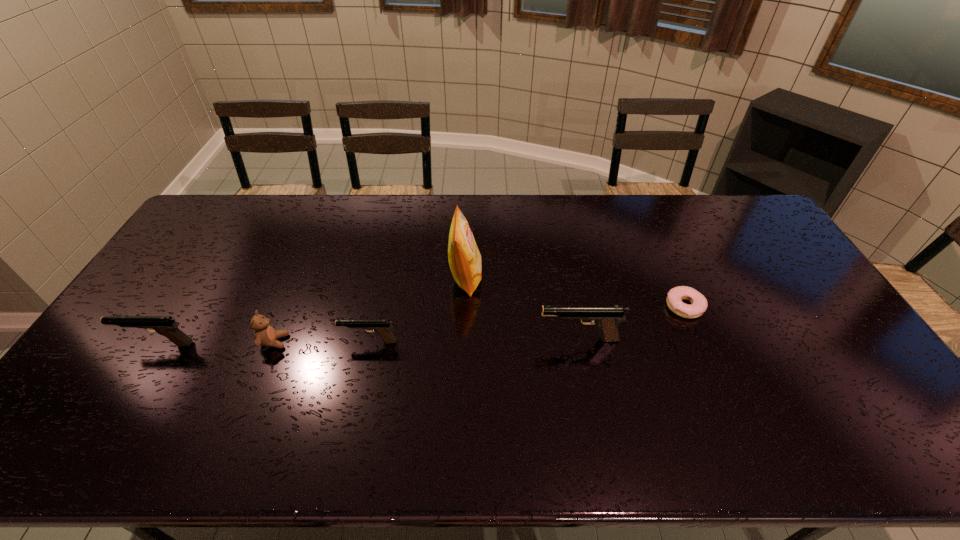
Locate an element on the screen. This screenshot has width=960, height=540. the leftmost object is located at coordinates click(x=164, y=325).

In order to click on the leftmost pistol in this screenshot , I will do `click(164, 325)`.

Image resolution: width=960 pixels, height=540 pixels. What are the coordinates of `the third object from left to right` in the screenshot? It's located at (382, 327).

Locate an element on the screen. The width and height of the screenshot is (960, 540). the second shortest object is located at coordinates (382, 327).

This screenshot has height=540, width=960. In order to click on the rightmost pistol in this screenshot , I will do `click(606, 317)`.

Image resolution: width=960 pixels, height=540 pixels. I want to click on the tallest pistol, so point(606,317).

Image resolution: width=960 pixels, height=540 pixels. In order to click on crisp (potato chip) in this screenshot , I will do tap(464, 258).

Where is `the third object from right to left`? This screenshot has width=960, height=540. the third object from right to left is located at coordinates (464, 258).

This screenshot has width=960, height=540. I want to click on the second object from left to right, so click(x=264, y=334).

Identify the location of the rightmost object. point(698,306).